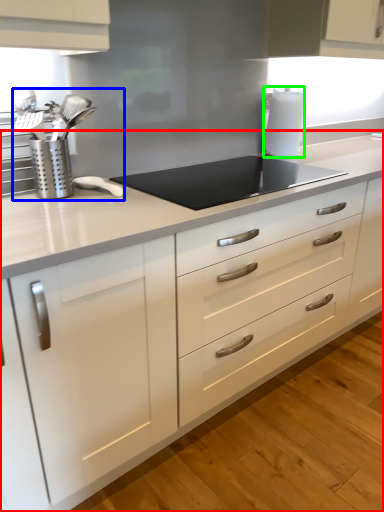
Question: Estimate the real-world distances between objects in this image. Which object is farther from countertop (highlighted by a red box), sink (highlighted by a blue box) or paper towel (highlighted by a green box)?

Choices:
 (A) sink
 (B) paper towel

Answer: (B)